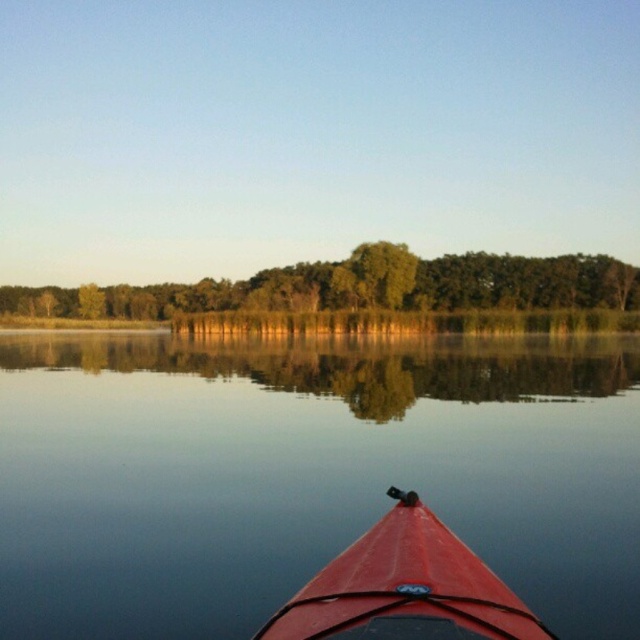
Between green leafy trees at upper center and shiny red canoe at lower center, which one is positioned lower?

shiny red canoe at lower center is below.

Is green leafy trees at upper center bigger than shiny red canoe at lower center?

Correct, green leafy trees at upper center is larger in size than shiny red canoe at lower center.

You are a GUI agent. You are given a task and a screenshot of the screen. Output one action in this format:
    pyautogui.click(x=<x>, y=<y>)
    Task: Click on the green leafy trees at upper center
    
    Given the screenshot: What is the action you would take?
    pyautogui.click(x=364, y=285)

Can you confirm if green leafy trees at upper center is wider than green leafy tree at center?

Correct, the width of green leafy trees at upper center exceeds that of green leafy tree at center.

Describe the element at coordinates (364, 285) in the screenshot. I see `green leafy trees at upper center` at that location.

Identify the location of green leafy trees at upper center. This screenshot has width=640, height=640. (364, 285).

Is smooth water at center positioned in front of green leafy tree at center?

That is True.

Describe the element at coordinates (307, 474) in the screenshot. I see `smooth water at center` at that location.

Does point (280, 410) lie in front of point (410, 253)?

Yes, point (280, 410) is closer to viewer.

You are a GUI agent. You are given a task and a screenshot of the screen. Output one action in this format:
    pyautogui.click(x=<x>, y=<y>)
    Task: Click on the smooth water at center
    This screenshot has width=640, height=640.
    Given the screenshot: What is the action you would take?
    pyautogui.click(x=307, y=474)